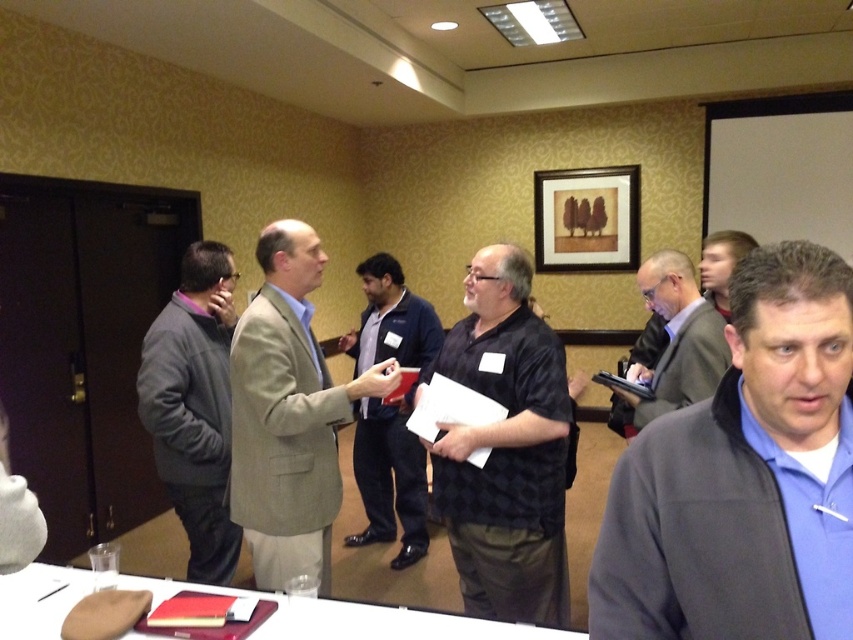
You are a photographer in the room and want to take a photo of both the black checkered shirt at center and the dark blue shirt at center. Which one should you focus on first to ensure both are in the frame?

You should focus on the black checkered shirt at center first since it is in front of the dark blue shirt at center, ensuring both are visible in the photo.

You are a photographer trying to capture a candid shot of both the black checkered shirt at center and the gray fleece jacket at left. Since you want to ensure both subjects are fully visible in the frame, which subject should you position closer to the camera to avoid cropping?

The black checkered shirt at center is not as tall as the gray fleece jacket at left. To ensure both are fully visible, position the black checkered shirt at center closer to the camera since it is shorter and might be partially hidden if the taller gray fleece jacket at left is in front.

You are a photographer at a conference and need to capture a photo of both the black checkered shirt at center and the dark blue shirt at center in the same frame. Your camera has a minimum focus distance of 30 inches. Will you be able to focus on both subjects simultaneously?

The black checkered shirt at center and dark blue shirt at center are 32.50 inches apart from each other. Since the distance between them is greater than the camera minimum focus distance of 30 inches, the photographer can focus on both subjects simultaneously.